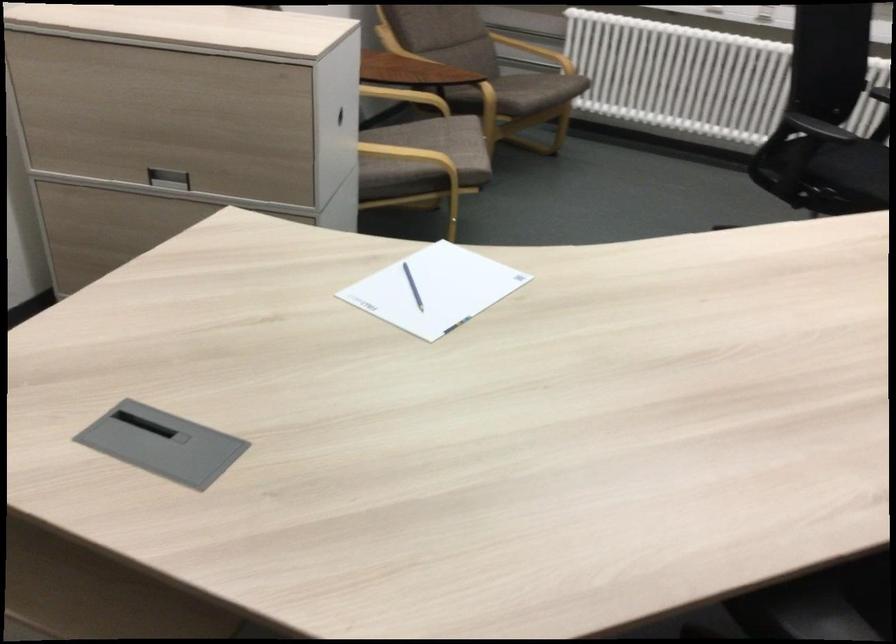
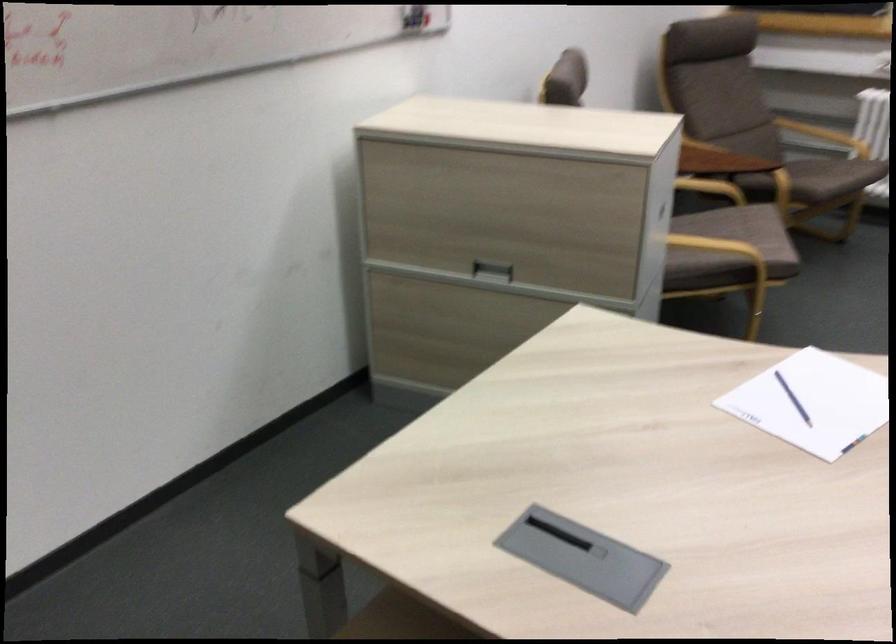
Question: The camera is either moving clockwise (left) or counter-clockwise (right) around the object. The first image is from the beginning of the video and the second image is from the end. Is the camera moving left or right when shooting the video?

Choices:
 (A) Left
 (B) Right

Answer: (B)